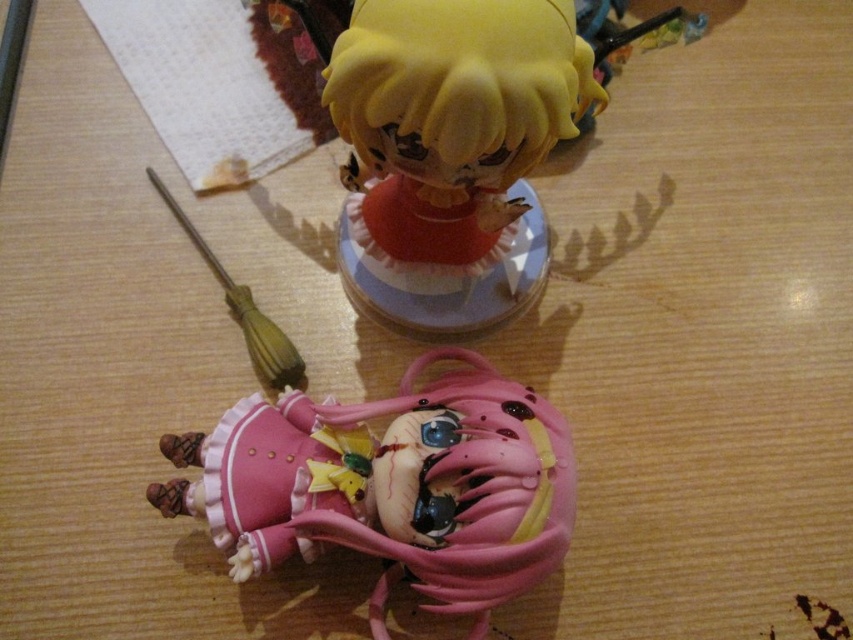
Can you confirm if pink matte doll at lower center is positioned above yellow matte figurine at upper center?

No, pink matte doll at lower center is not above yellow matte figurine at upper center.

Who is lower down, pink matte doll at lower center or yellow matte figurine at upper center?

Positioned lower is pink matte doll at lower center.

Describe the element at coordinates (392, 486) in the screenshot. Image resolution: width=853 pixels, height=640 pixels. I see `pink matte doll at lower center` at that location.

Locate an element on the screen. The width and height of the screenshot is (853, 640). pink matte doll at lower center is located at coordinates 392,486.